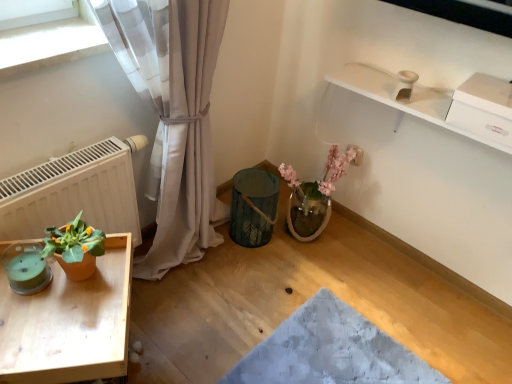
The height and width of the screenshot is (384, 512). Find the location of `vacant point to the right of teal glass candle at lower left`. vacant point to the right of teal glass candle at lower left is located at coordinates click(91, 297).